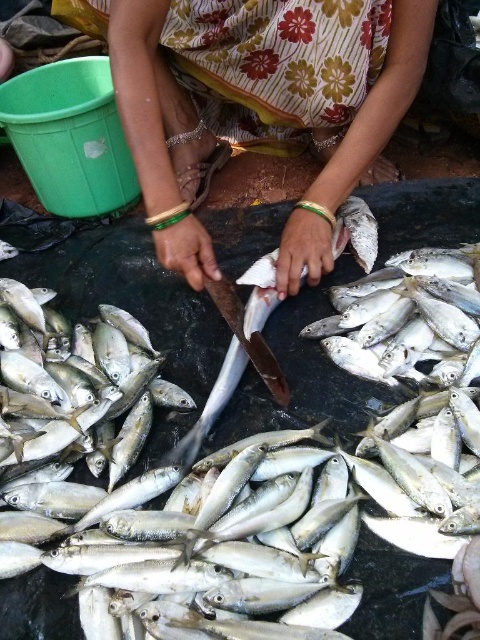
Is floral fabric skirt at center taller than shiny silver fish at center?

Yes, floral fabric skirt at center is taller than shiny silver fish at center.

Between floral fabric skirt at center and shiny silver fish at center, which one is positioned higher?

Positioned higher is floral fabric skirt at center.

The width and height of the screenshot is (480, 640). What are the coordinates of `floral fabric skirt at center` in the screenshot? It's located at (256, 100).